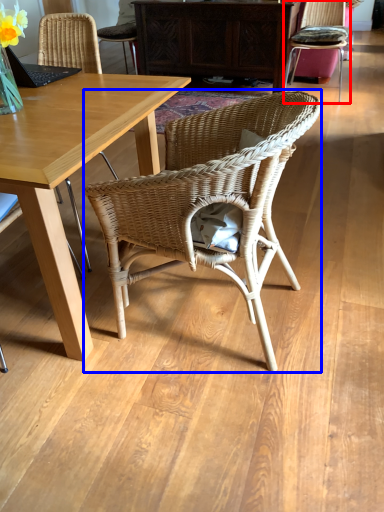
Question: Which point is further to the camera, chair (highlighted by a red box) or chair (highlighted by a blue box)?

Choices:
 (A) chair
 (B) chair

Answer: (A)